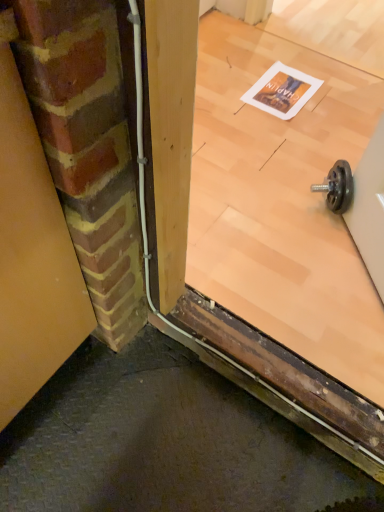
Question: Which is correct: matte yellow garage door at left is inside transparent glass door at center, or outside of it?

Choices:
 (A) inside
 (B) outside

Answer: (B)

Question: Relative to transparent glass door at center, is matte yellow garage door at left in front or behind?

Choices:
 (A) behind
 (B) front

Answer: (B)

Question: Visually, is matte yellow garage door at left positioned to the left or to the right of transparent glass door at center?

Choices:
 (A) left
 (B) right

Answer: (A)

Question: Considering the positions of transparent glass door at center and matte yellow garage door at left in the image, is transparent glass door at center taller or shorter than matte yellow garage door at left?

Choices:
 (A) tall
 (B) short

Answer: (B)

Question: Looking at their shapes, would you say transparent glass door at center is wider or thinner than matte yellow garage door at left?

Choices:
 (A) wide
 (B) thin

Answer: (A)

Question: From the image's perspective, is transparent glass door at center above or below matte yellow garage door at left?

Choices:
 (A) above
 (B) below

Answer: (A)

Question: Considering the relative positions of transparent glass door at center and matte yellow garage door at left in the image provided, is transparent glass door at center to the left or to the right of matte yellow garage door at left?

Choices:
 (A) right
 (B) left

Answer: (A)